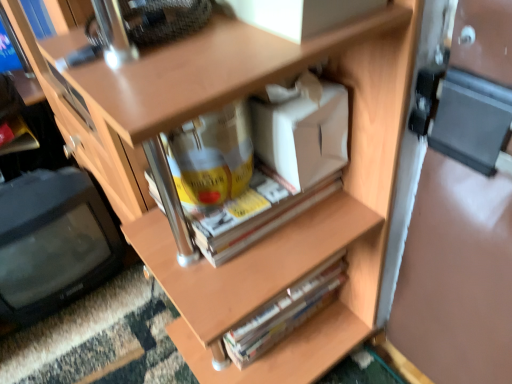
Question: Is white cardboard box at center situated inside hardcover book at center or outside?

Choices:
 (A) inside
 (B) outside

Answer: (B)

Question: In terms of height, does white cardboard box at center look taller or shorter compared to hardcover book at center?

Choices:
 (A) short
 (B) tall

Answer: (A)

Question: Estimate the real-world distances between objects in this image. Which object is closer to the hardcover book at center?

Choices:
 (A) black plastic computer monitor at left
 (B) white cardboard box at center

Answer: (B)

Question: Which object is positioned closest to the white cardboard box at center?

Choices:
 (A) hardcover book at center
 (B) black plastic computer monitor at left

Answer: (A)